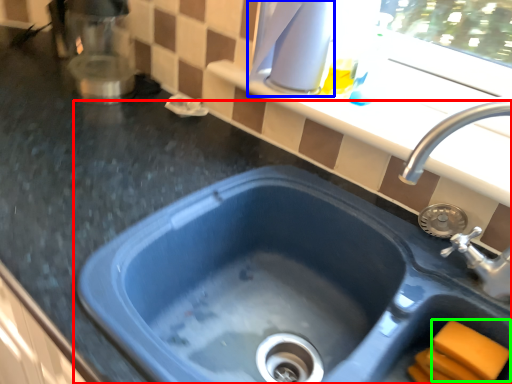
Question: Considering the real-world distances, which object is farthest from sink (highlighted by a red box)? appliance (highlighted by a blue box) or soap (highlighted by a green box)?

Choices:
 (A) appliance
 (B) soap

Answer: (A)